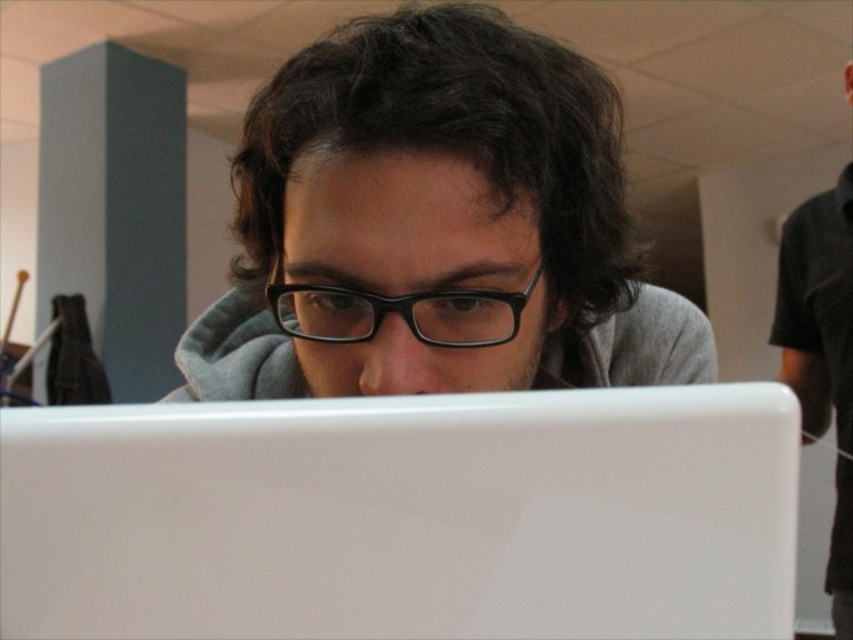
You are designing a desk layout and need to place the white glossy laptop at center and the black matte shirt at right. Since the desk space is limited, which object requires more horizontal space?

The black matte shirt at right requires more horizontal space because its width is greater than the white glossy laptop at center.

You are a photographer adjusting your camera to focus on the subject in the image. You notice the matte black glasses at center and the black matte shirt at right. Which object is closer to the camera lens?

The matte black glasses at center is in front of the black matte shirt at right, so the matte black glasses at center is closer to the camera lens.